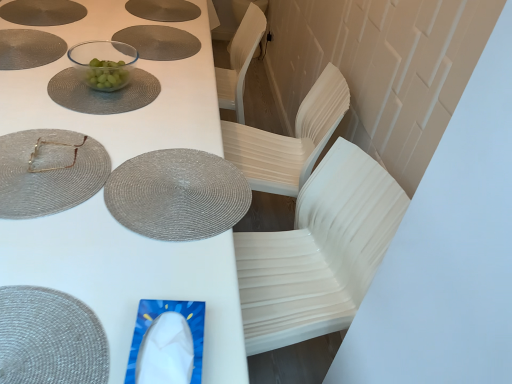
Question: In the image, is transparent glass bowl at upper center, the first glass plate in the back-to-front sequence, on the left side or the right side of matte silver placemat at upper left, the 1th platter in the left-to-right sequence?

Choices:
 (A) right
 (B) left

Answer: (A)

Question: Is point (72, 92) closer or farther from the camera than point (10, 3)?

Choices:
 (A) closer
 (B) farther

Answer: (A)

Question: Which is nearer to the gold metallic square at upper left, which is the 3th tableware in front-to-back order?

Choices:
 (A) transparent glass bowl at upper center, the 1th glass plate positioned from the top
 (B) matte gray placemat at upper left, the second plate positioned from the right
 (C) matte silver placemat at upper left, the 2th platter viewed from the right
 (D) matte gray placemat at upper center, which is counted as the 2th platter, starting from the left
 (E) white plastic table at center

Answer: (A)

Question: Considering the real-world distances, which object is closest to the matte gray placemat at upper center, which appears as the 2th plate when viewed from the left?

Choices:
 (A) clear glass bowl at upper center, which appears as the fourth tableware when viewed from the front
 (B) rattan placemat at lower left, arranged as the fourth tableware when viewed from the back
 (C) matte gray placemat at upper center, which is the 1th platter from right to left
 (D) matte woven placemat at upper left, which is the 2th glass plate from top to bottom
 (E) matte gray placemat at upper left, the first plate from the left

Answer: (A)